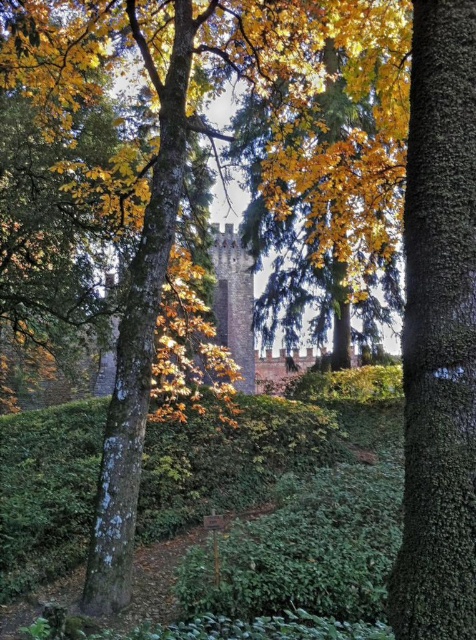
Between smooth brown tree trunk at right and green leafy hedge at center, which one is positioned lower?

Result: green leafy hedge at center is lower down.

Which of these two, smooth brown tree trunk at right or green leafy hedge at center, stands taller?

smooth brown tree trunk at right is taller.

Does point (420, 410) come in front of point (73, 449)?

Yes.

The image size is (476, 640). I want to click on smooth brown tree trunk at right, so click(x=438, y=332).

Consider the image. Can you confirm if green leafy hedge at center is shorter than green rough bark tree trunk at center?

Indeed, green leafy hedge at center has a lesser height compared to green rough bark tree trunk at center.

Where is `green leafy hedge at center`? Image resolution: width=476 pixels, height=640 pixels. green leafy hedge at center is located at coordinates (227, 460).

Can you confirm if smooth brown tree trunk at right is positioned to the right of green rough bark tree trunk at center?

Indeed, smooth brown tree trunk at right is positioned on the right side of green rough bark tree trunk at center.

Which is more to the right, smooth brown tree trunk at right or green rough bark tree trunk at center?

smooth brown tree trunk at right is more to the right.

What do you see at coordinates (438, 332) in the screenshot? I see `smooth brown tree trunk at right` at bounding box center [438, 332].

Where is `smooth brown tree trunk at right`? The image size is (476, 640). smooth brown tree trunk at right is located at coordinates (438, 332).